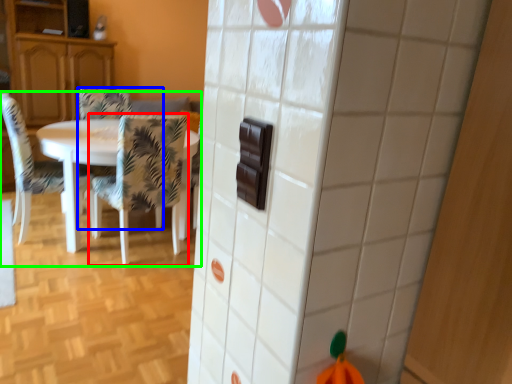
Question: Which is nearer to the chair (highlighted by a red box)? chair (highlighted by a blue box) or kitchen & dining room table (highlighted by a green box).

Choices:
 (A) chair
 (B) kitchen & dining room table

Answer: (B)